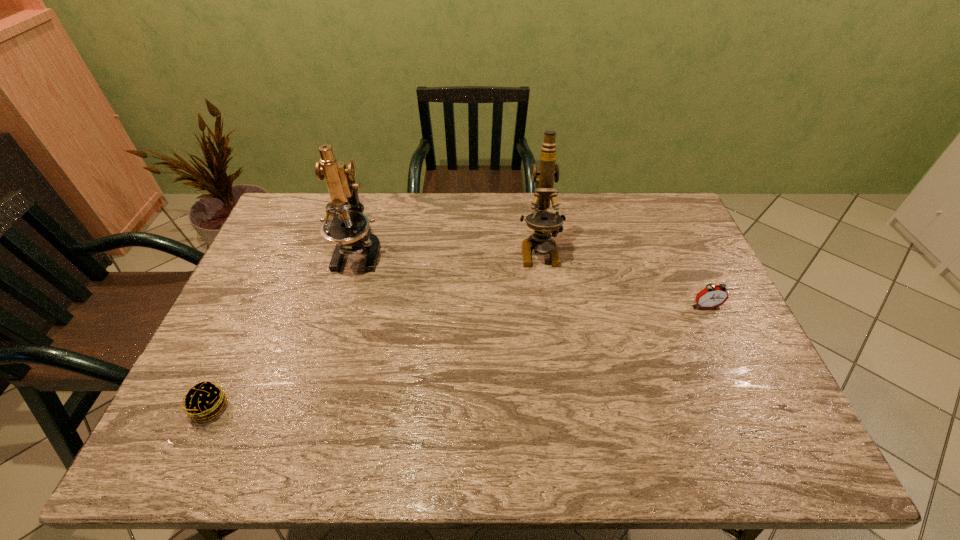
Locate an element on the screen. The width and height of the screenshot is (960, 540). free spot between the shortest object and the third object from right to left is located at coordinates (284, 329).

At what (x,y) coordinates should I click in order to perform the action: click on free spot between the shortest object and the left microscope. Please return your answer as a coordinate pair (x, y). Looking at the image, I should click on (284, 329).

The image size is (960, 540). In order to click on free area in between the nearest object and the left microscope in this screenshot , I will do `click(284, 329)`.

Identify the location of free point between the alarm clock and the right microscope. (623, 278).

I want to click on free spot between the alarm clock and the left microscope, so click(x=532, y=279).

This screenshot has width=960, height=540. What are the coordinates of `empty location between the alarm clock and the patty` in the screenshot? It's located at (458, 356).

Identify the location of free area in between the third object from right to left and the third tallest object. (532, 279).

At what (x,y) coordinates should I click in order to perform the action: click on vacant area that lies between the third farthest object and the second object from right to left. Please return your answer as a coordinate pair (x, y). The width and height of the screenshot is (960, 540). Looking at the image, I should click on (623, 278).

Find the location of a particular element. The height and width of the screenshot is (540, 960). free space between the alarm clock and the right microscope is located at coordinates (623, 278).

Find the location of `object that is the third closest to the left microscope`. object that is the third closest to the left microscope is located at coordinates (712, 296).